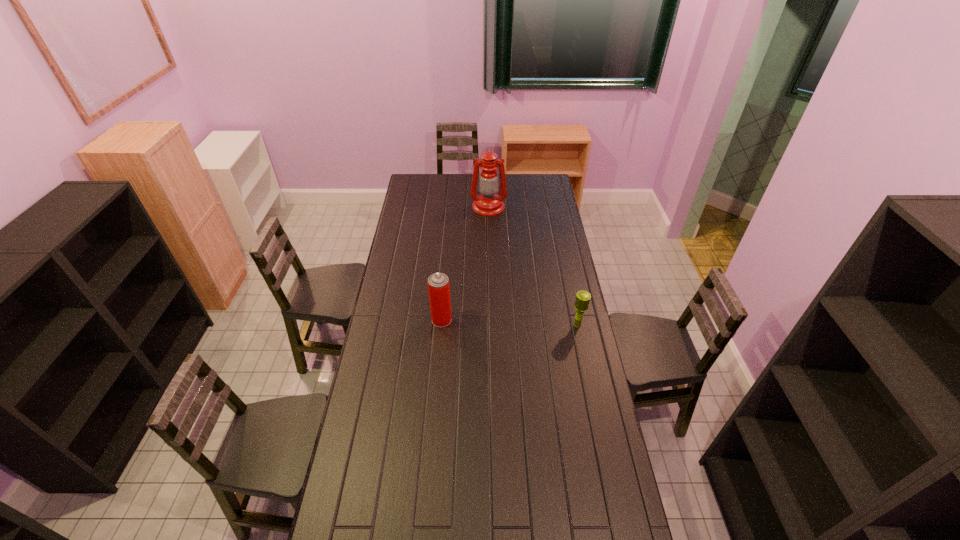
Image resolution: width=960 pixels, height=540 pixels. In order to click on vacant space at the left edge in this screenshot , I will do `click(386, 415)`.

Image resolution: width=960 pixels, height=540 pixels. Find the location of `free spot at the right edge of the desktop`. free spot at the right edge of the desktop is located at coordinates (572, 423).

Locate an element on the screen. This screenshot has width=960, height=540. free space between the second tallest object and the rightmost object is located at coordinates (510, 322).

Where is `free area in between the farthest object and the shortest object`? free area in between the farthest object and the shortest object is located at coordinates (533, 266).

Where is `vacant space that is in between the aerosol can and the second object from left to right`? This screenshot has height=540, width=960. vacant space that is in between the aerosol can and the second object from left to right is located at coordinates (465, 264).

Locate an element on the screen. The width and height of the screenshot is (960, 540). free spot between the second object from left to right and the leftmost object is located at coordinates (465, 264).

Locate an element on the screen. unoccupied position between the shortest object and the leftmost object is located at coordinates (510, 322).

You are a GUI agent. You are given a task and a screenshot of the screen. Output one action in this format:
    pyautogui.click(x=<x>, y=<y>)
    Task: Click on the free space between the leftmost object and the second object from left to right
    
    Given the screenshot: What is the action you would take?
    pyautogui.click(x=465, y=264)

Locate an element on the screen. The image size is (960, 540). free space between the aerosol can and the tallest object is located at coordinates (465, 264).

Where is `object that is the second nearest to the rightmost object`? Image resolution: width=960 pixels, height=540 pixels. object that is the second nearest to the rightmost object is located at coordinates (488, 203).